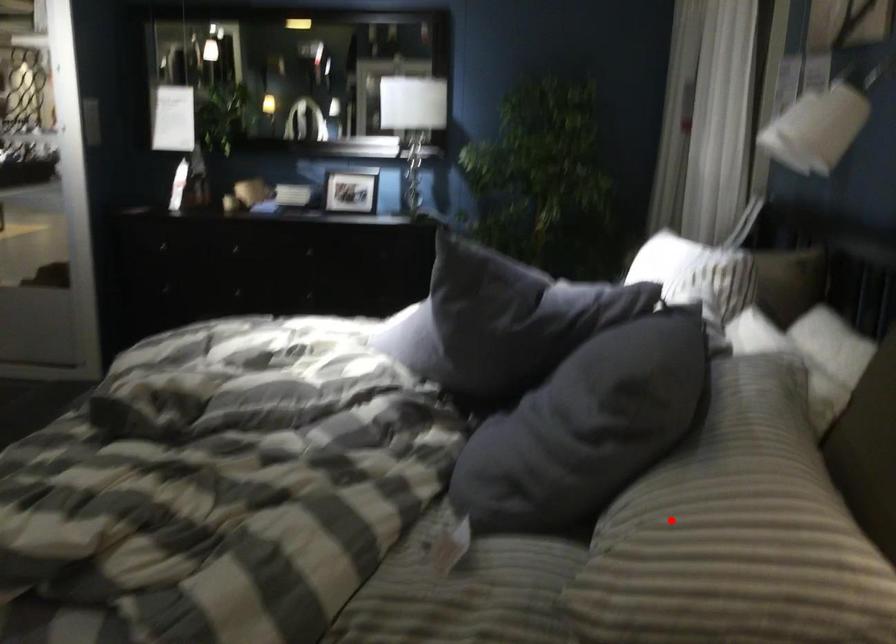
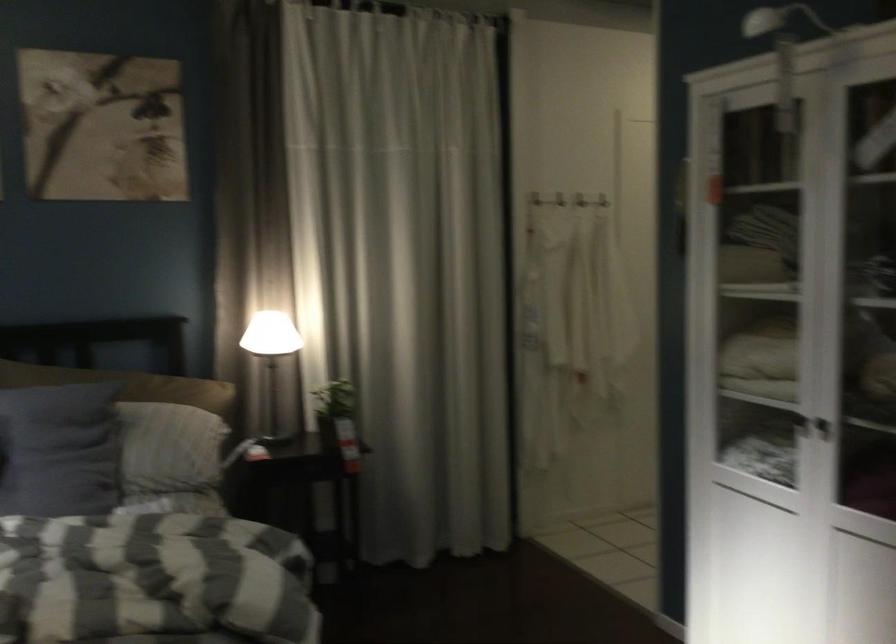
Question: A red point is marked in image1. In image2, is the corresponding 3D point closer to the camera or farther? Reply with the corresponding letter.

Choices:
 (A) The corresponding 3D point is closer.
 (B) The corresponding 3D point is farther.

Answer: (B)